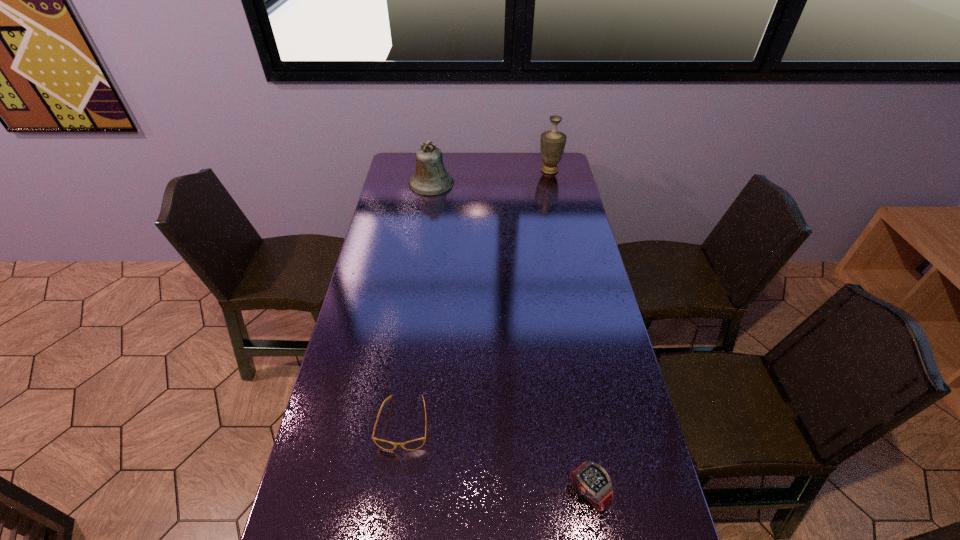
In the image, there is a desktop. At what (x,y) coordinates should I click in order to perform the action: click on vacant space at the right edge. Please return your answer as a coordinate pair (x, y). The width and height of the screenshot is (960, 540). Looking at the image, I should click on (559, 278).

Locate an element on the screen. This screenshot has height=540, width=960. empty space between the urn and the second nearest object is located at coordinates (477, 296).

The width and height of the screenshot is (960, 540). I want to click on unoccupied position between the bell and the tallest object, so click(x=491, y=177).

Identify the location of empty location between the second tallest object and the sunglasses. The height and width of the screenshot is (540, 960). (418, 303).

The width and height of the screenshot is (960, 540). I want to click on empty space that is in between the second nearest object and the tallest object, so click(x=477, y=296).

Where is `free area in between the nearest object and the urn`? The image size is (960, 540). free area in between the nearest object and the urn is located at coordinates (569, 332).

Locate an element on the screen. This screenshot has height=540, width=960. object that is the second closest one to the bell is located at coordinates (415, 444).

Select which object is the second closest to the tallest object. Please provide its 2D coordinates. Your answer should be formatted as a tuple, i.e. [(x, y)], where the tuple contains the x and y coordinates of a point satisfying the conditions above.

[(415, 444)]

In order to click on vacant area that satisfies the following two spatial constraints: 1. on the front-facing side of the sunglasses; 2. on the right side of the watch in this screenshot , I will do `click(395, 493)`.